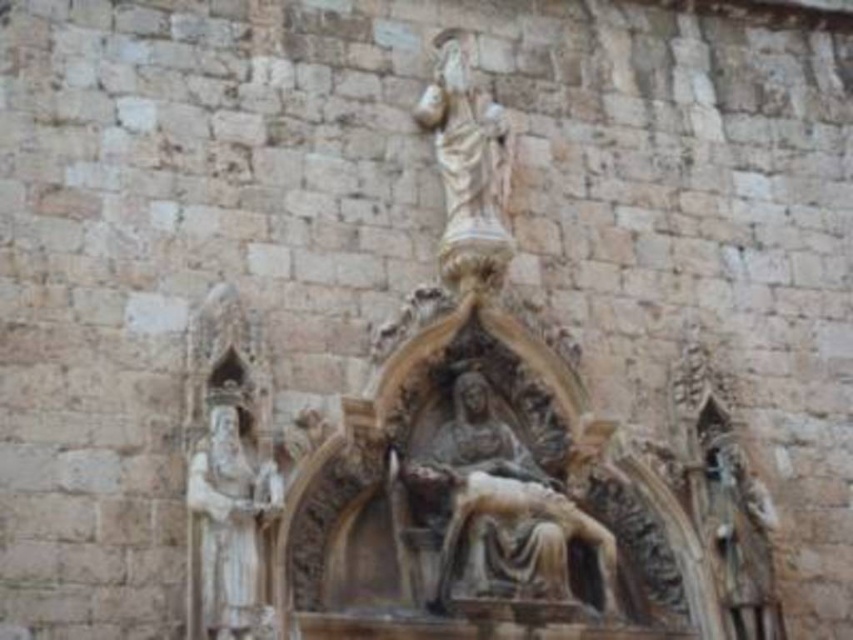
Question: Does polished stone pieta at center appear over white stone statue at left?

Choices:
 (A) yes
 (B) no

Answer: (B)

Question: Which point appears closest to the camera in this image?

Choices:
 (A) (187, 593)
 (B) (425, 490)

Answer: (A)

Question: Can you confirm if polished stone pieta at center is positioned below white stone statue at left?

Choices:
 (A) yes
 (B) no

Answer: (A)

Question: Which point appears farthest from the camera in this image?

Choices:
 (A) (250, 566)
 (B) (451, 440)

Answer: (B)

Question: Observing the image, what is the correct spatial positioning of polished stone pieta at center in reference to white stone statue at left?

Choices:
 (A) left
 (B) right

Answer: (B)